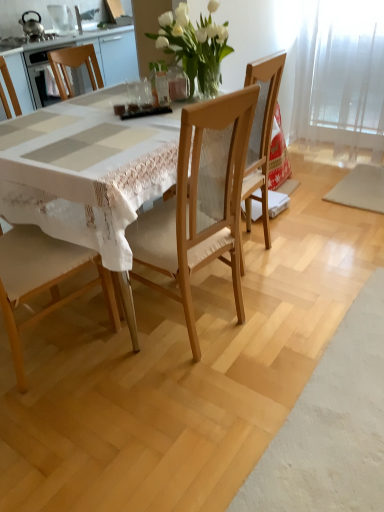
Where is `vacant area that is situated to the right of white fabric chair at left, the 1th chair when ordered from left to right`? vacant area that is situated to the right of white fabric chair at left, the 1th chair when ordered from left to right is located at coordinates (125, 366).